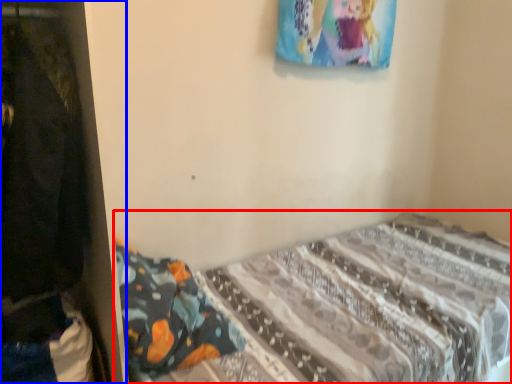
Question: Among these objects, which one is nearest to the camera, bed (highlighted by a red box) or closet (highlighted by a blue box)?

Choices:
 (A) bed
 (B) closet

Answer: (B)